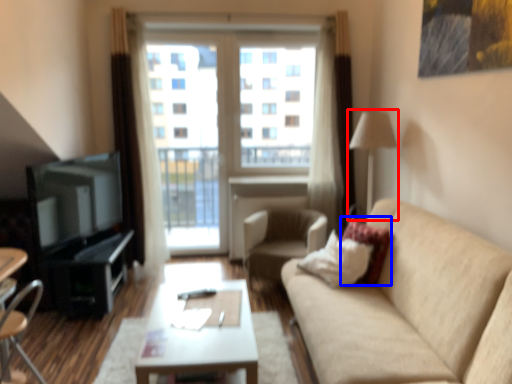
Question: Which object appears farthest to the camera in this image, lamp (highlighted by a red box) or pillow (highlighted by a blue box)?

Choices:
 (A) lamp
 (B) pillow

Answer: (A)